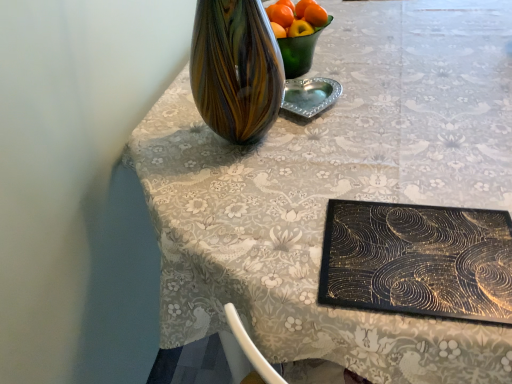
Find the location of `free location in front of silver metallic heart-shaped tray at center`. free location in front of silver metallic heart-shaped tray at center is located at coordinates (318, 143).